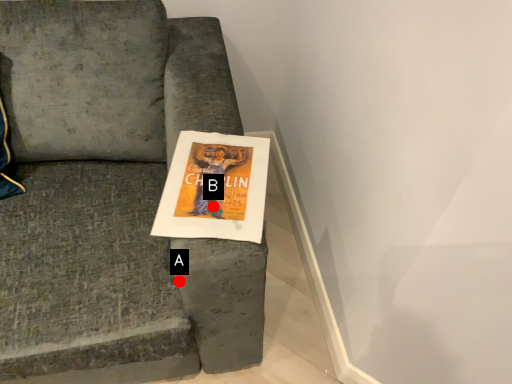
Question: Two points are circled on the image, labeled by A and B beside each circle. Which of the following is the closest to the observer?

Choices:
 (A) A is closer
 (B) B is closer

Answer: (A)